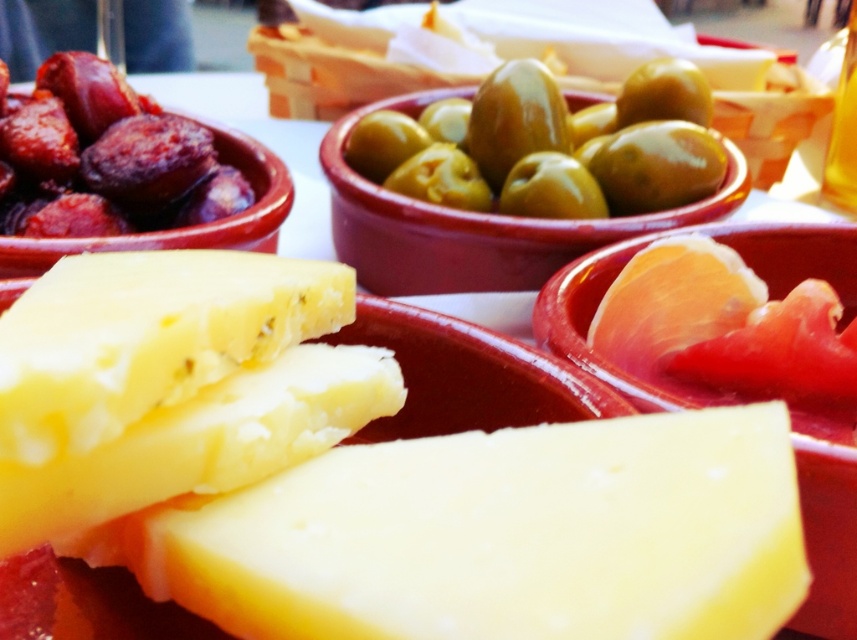
Describe the element at coordinates (505, 536) in the screenshot. I see `yellow creamy cheese at center` at that location.

Based on the photo, does yellow creamy cheese at center appear under shiny brown sausage at upper left?

Indeed, yellow creamy cheese at center is positioned under shiny brown sausage at upper left.

Where is `yellow creamy cheese at center`? This screenshot has height=640, width=857. yellow creamy cheese at center is located at coordinates (505, 536).

Can you confirm if green glossy olives at center is thinner than shiny brown sausage at upper left?

In fact, green glossy olives at center might be wider than shiny brown sausage at upper left.

Does green glossy olives at center appear under shiny brown sausage at upper left?

No, green glossy olives at center is not below shiny brown sausage at upper left.

Who is more distant from viewer, (440, 147) or (198, 221)?

The point (440, 147) is behind.

Identify the location of green glossy olives at center. (548, 147).

Who is shorter, yellow creamy cheese at center or green glossy olives at center?

yellow creamy cheese at center is shorter.

The image size is (857, 640). I want to click on yellow creamy cheese at center, so click(505, 536).

I want to click on yellow creamy cheese at center, so click(505, 536).